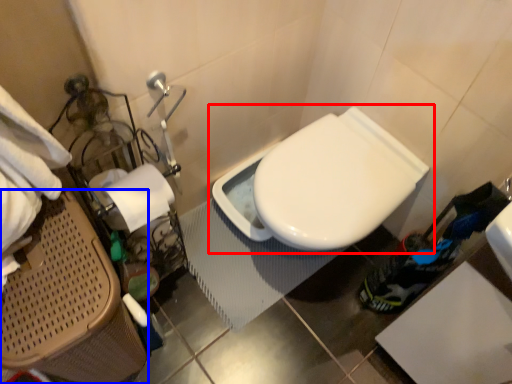
Question: Which object appears farthest to the camera in this image, toilet (highlighted by a red box) or laundry basket (highlighted by a blue box)?

Choices:
 (A) toilet
 (B) laundry basket

Answer: (A)